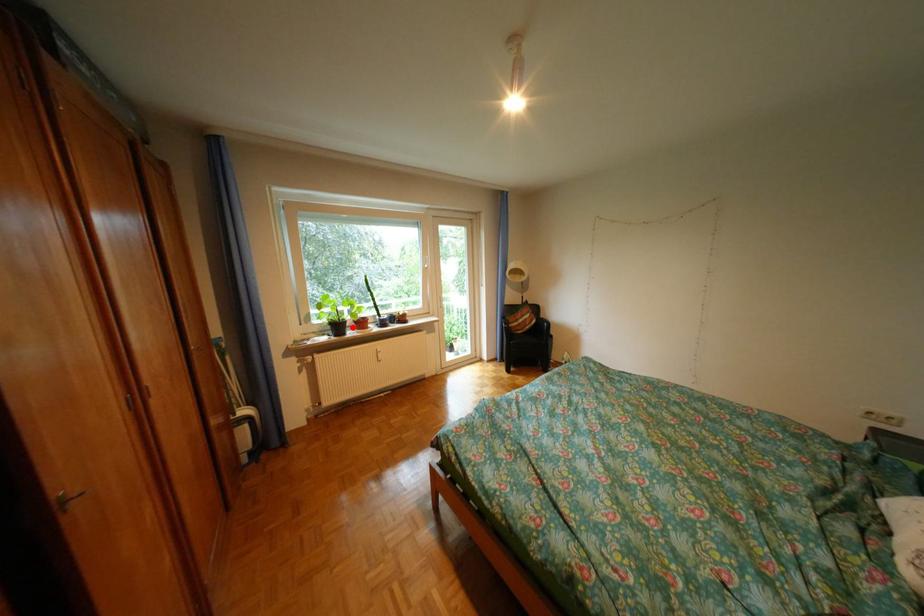
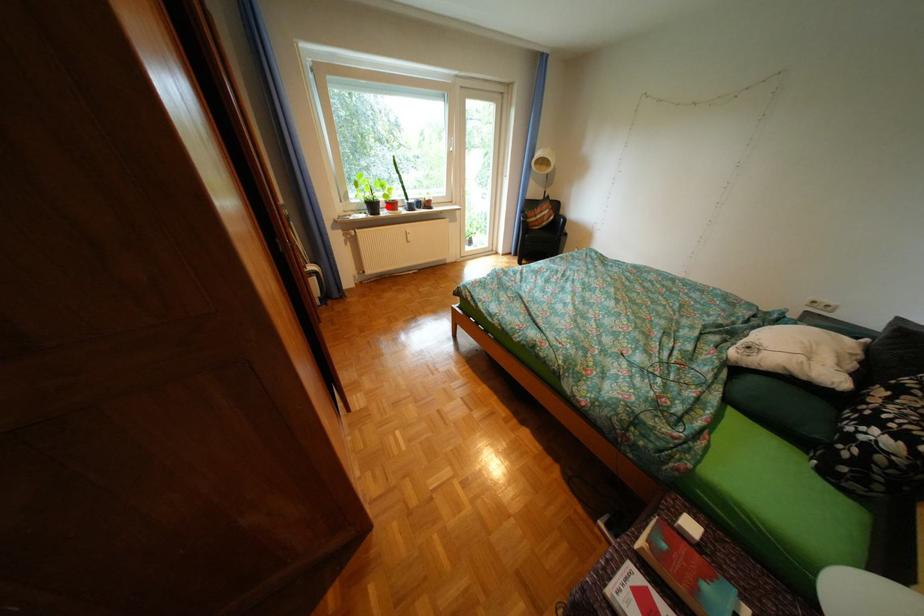
I am providing you with two images of the same scene from different viewpoints. A red point is marked on the first image and another point is marked on the second image. Do the highlighted points in image1 and image2 indicate the same real-world spot?

Yes